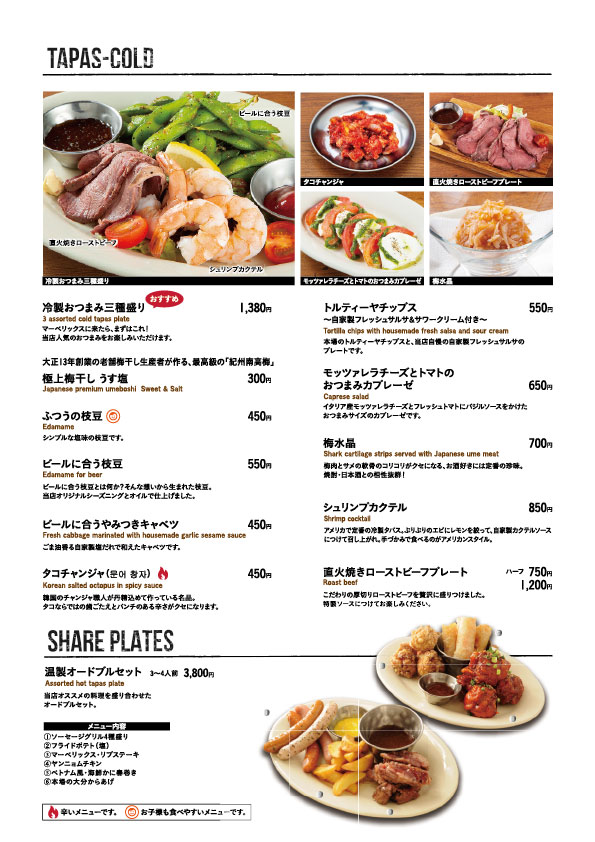
This screenshot has width=595, height=842. I want to click on plate, so click(x=394, y=689), click(x=443, y=791).